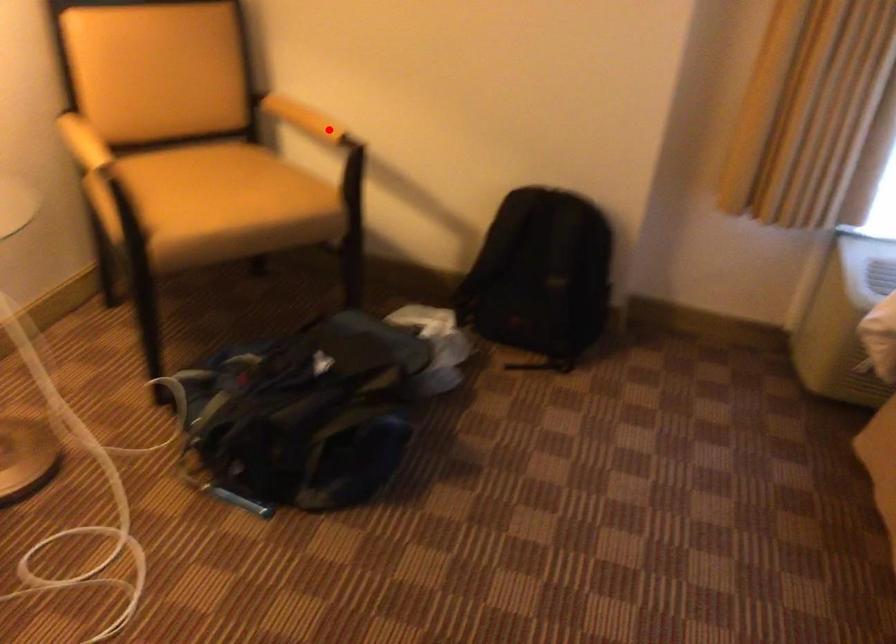
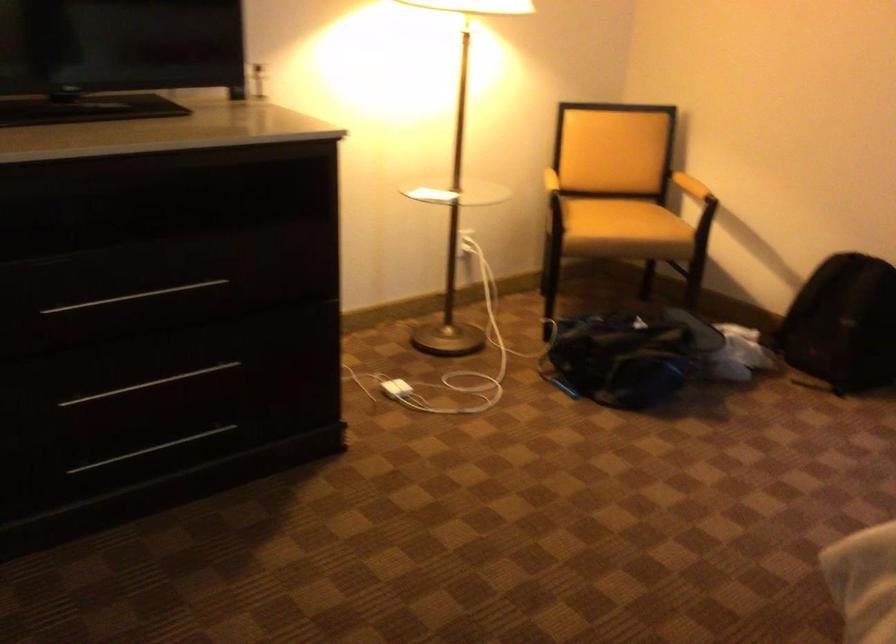
Question: I am providing you with two images of the same scene from different viewpoints. A red point is marked on the first image. Can you still see the location of the red point in image 2?

Choices:
 (A) Yes
 (B) No

Answer: (A)